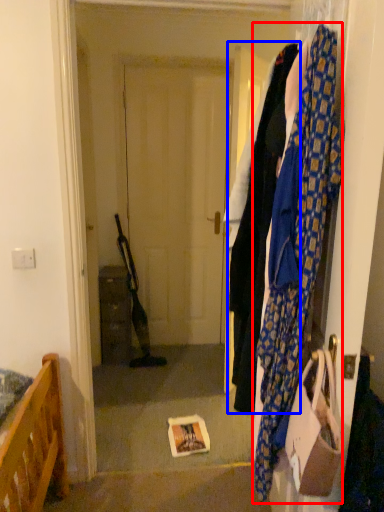
Question: Among these objects, which one is farthest to the camera, scarf (highlighted by a red box) or clothing (highlighted by a blue box)?

Choices:
 (A) scarf
 (B) clothing

Answer: (B)